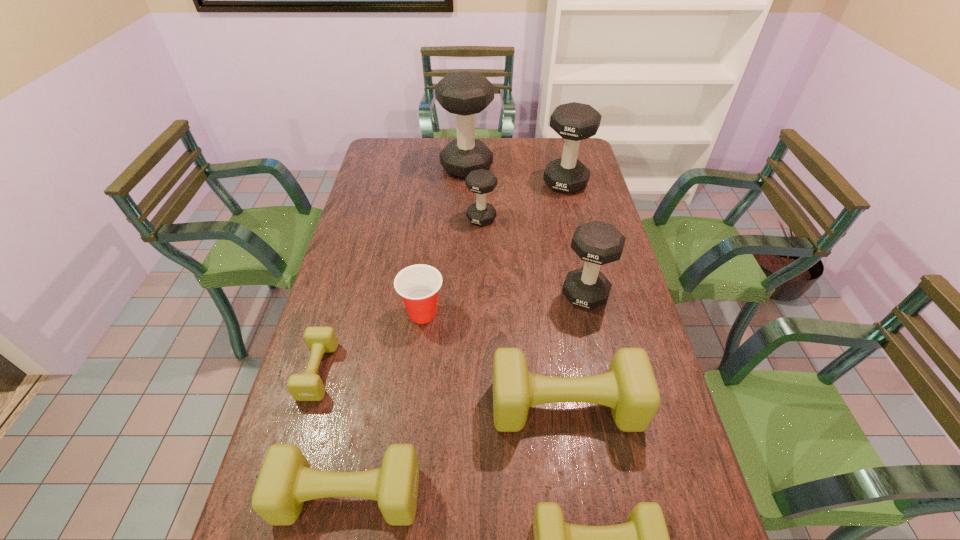
Locate an element on the screen. Image resolution: width=960 pixels, height=540 pixels. the second biggest olive dumbbell is located at coordinates (286, 480).

The width and height of the screenshot is (960, 540). Identify the location of the shortest object. (303, 387).

At what (x,y) coordinates should I click in order to perform the action: click on the smallest olive dumbbell. Please return your answer as a coordinate pair (x, y). The image size is (960, 540). Looking at the image, I should click on click(303, 387).

I want to click on free space located on the left of the biggest gray dumbbell, so pyautogui.click(x=428, y=167).

Locate an element on the screen. The height and width of the screenshot is (540, 960). vacant space situated 0.190m on the front of the second tallest object is located at coordinates pos(576,228).

At what (x,y) coordinates should I click in order to perform the action: click on free space located on the left of the sixth shortest dumbbell. Please return your answer as a coordinate pair (x, y). The height and width of the screenshot is (540, 960). Looking at the image, I should click on (539, 294).

Locate an element on the screen. The image size is (960, 540). free space located 0.200m on the front of the smallest gray dumbbell is located at coordinates (482, 267).

Identify the location of vacant region located 0.170m on the left of the fourth shortest dumbbell. (424, 406).

In order to click on vacant space located on the left of the red cup in this screenshot , I will do `click(332, 313)`.

Identify the location of free space located on the right of the third shortest dumbbell. (469, 495).